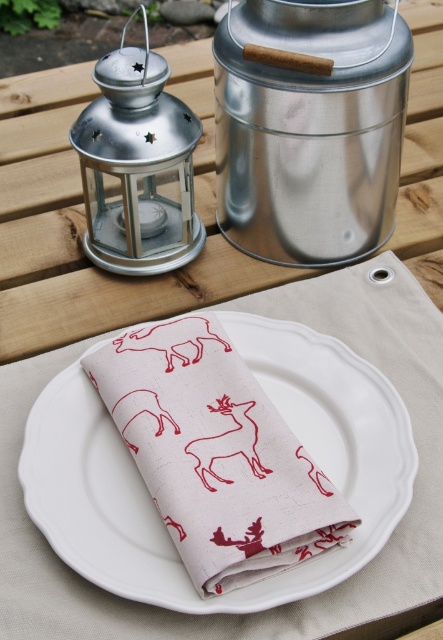
Consider the image. You are standing at the center of the table and want to place a decoration between the two points labeled as point (287,352) and point (159,148). Which point should you move towards to ensure the decoration is closer to the front of the table?

You should move towards point (287,352) because it is in front of point (159,148), so placing the decoration there will be closer to the front of the table.